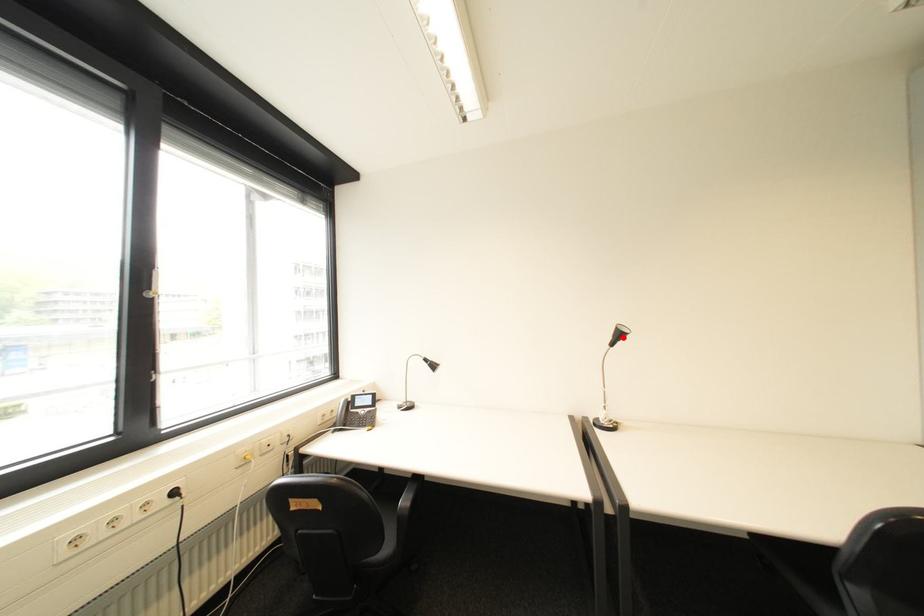
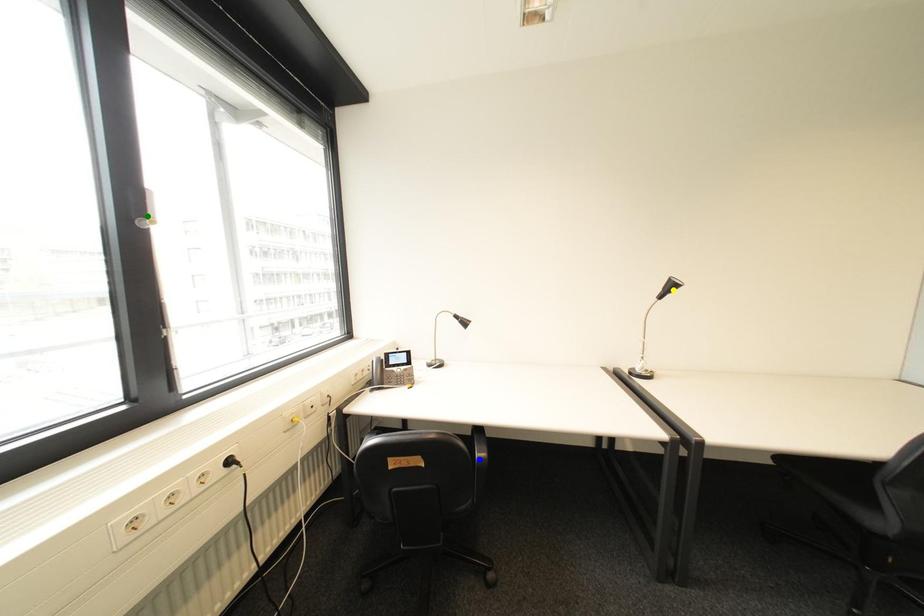
Question: I am providing you with two images of the same scene from different viewpoints. A red point is marked on the first image. You are given multiple points on the second image. Which spot in image 2 lines up with the point in image 1?

Choices:
 (A) blue point
 (B) yellow point
 (C) green point

Answer: (B)